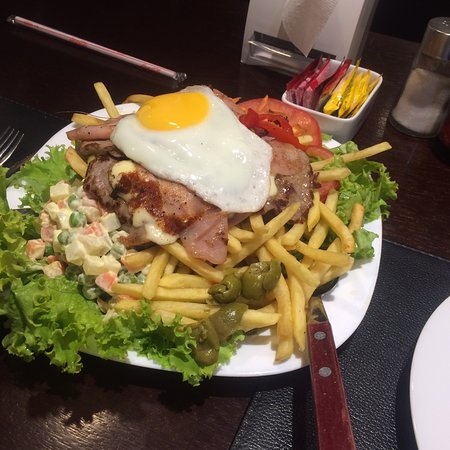
Identify the location of spoon wooden handle. Image resolution: width=450 pixels, height=450 pixels. (335, 407).